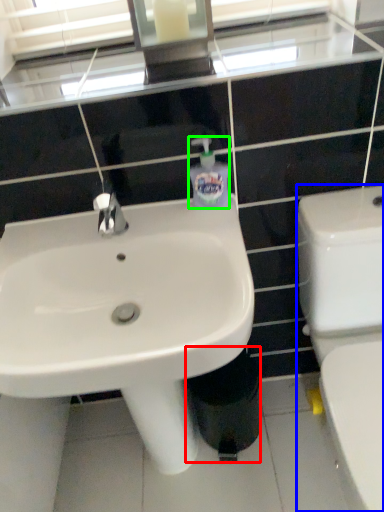
Question: Which is farther away from trash bin/can (highlighted by a red box)? toilet (highlighted by a blue box) or toiletries (highlighted by a green box)?

Choices:
 (A) toilet
 (B) toiletries

Answer: (B)